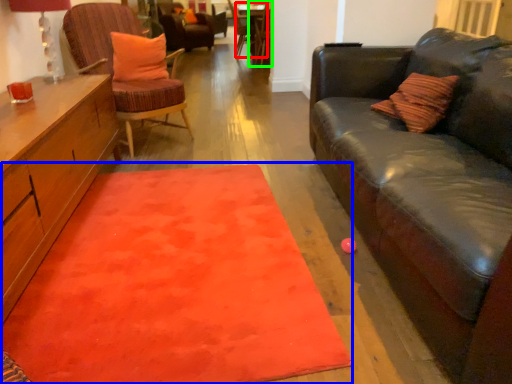
Question: Which is farther away from side table (highlighted by a red box)? mat (highlighted by a blue box) or chair (highlighted by a green box)?

Choices:
 (A) mat
 (B) chair

Answer: (A)